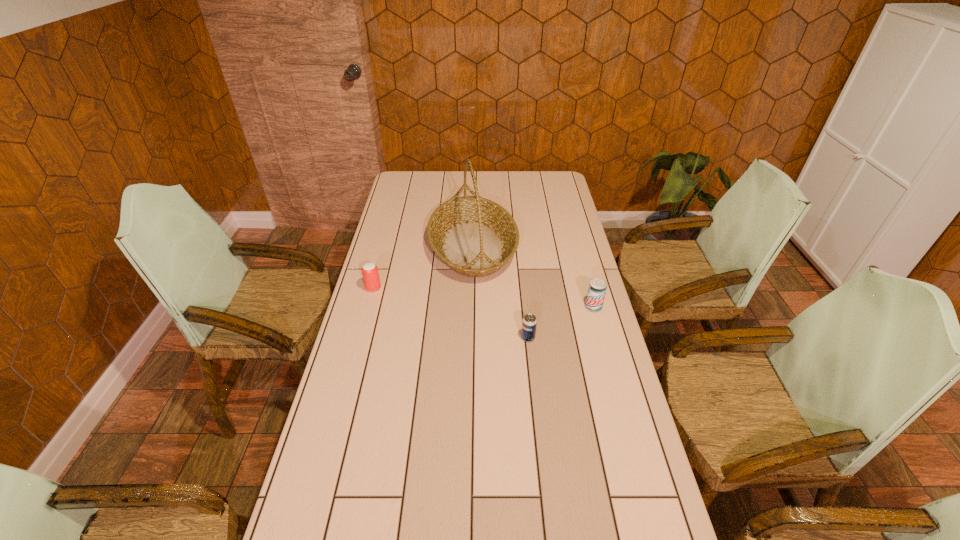
Image resolution: width=960 pixels, height=540 pixels. Find the location of `free region located 0.110m on the right of the shortest object`. free region located 0.110m on the right of the shortest object is located at coordinates (568, 338).

Locate an element on the screen. The height and width of the screenshot is (540, 960). object present at the left edge is located at coordinates (370, 273).

Find the location of a particular element. The height and width of the screenshot is (540, 960). object at the right edge is located at coordinates (597, 289).

I want to click on vacant region at the far edge of the desktop, so click(471, 178).

Find the location of `vacant area at the left edge of the desktop`. vacant area at the left edge of the desktop is located at coordinates (404, 228).

In the image, there is a desktop. Where is `blank space at the right edge`? This screenshot has width=960, height=540. blank space at the right edge is located at coordinates (582, 315).

This screenshot has height=540, width=960. Find the location of `free spot at the far left corner of the desktop`. free spot at the far left corner of the desktop is located at coordinates (427, 172).

This screenshot has height=540, width=960. In order to click on free spot between the second beer can from left to right and the basket in this screenshot , I will do `click(500, 292)`.

Identify the location of free space between the tallest object and the leftmost object. Image resolution: width=960 pixels, height=540 pixels. (423, 267).

Image resolution: width=960 pixels, height=540 pixels. Identify the location of vacant point located between the leftmost beer can and the basket. (423, 267).